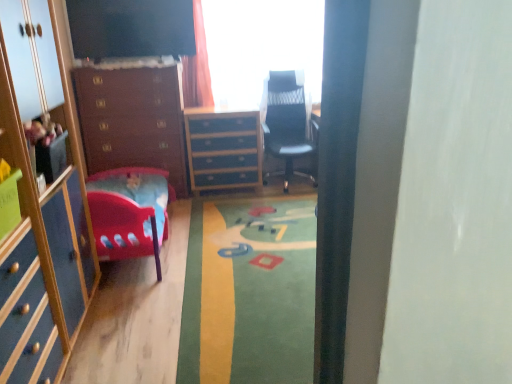
Question: Is wooden chest of drawers at left, marked as the first chest of drawers in a left-to-right arrangement, taller or shorter than transparent glass window at upper center?

Choices:
 (A) short
 (B) tall

Answer: (B)

Question: Does point (80, 69) appear closer or farther from the camera than point (240, 21)?

Choices:
 (A) farther
 (B) closer

Answer: (B)

Question: Which is farther from the black mesh office chair at center?

Choices:
 (A) wooden chest of drawers at left, which is the second chest of drawers from right to left
 (B) blue painted wood chest of drawers at center, which is counted as the 2th chest of drawers, starting from the left
 (C) matte blue cabinet at left
 (D) transparent glass window at upper center

Answer: (C)

Question: Estimate the real-world distances between objects in this image. Which object is farther from the matte blue cabinet at left?

Choices:
 (A) black mesh office chair at center
 (B) wooden chest of drawers at left, which is the second chest of drawers from right to left
 (C) transparent glass window at upper center
 (D) blue painted wood chest of drawers at center, acting as the first chest of drawers starting from the right

Answer: (A)